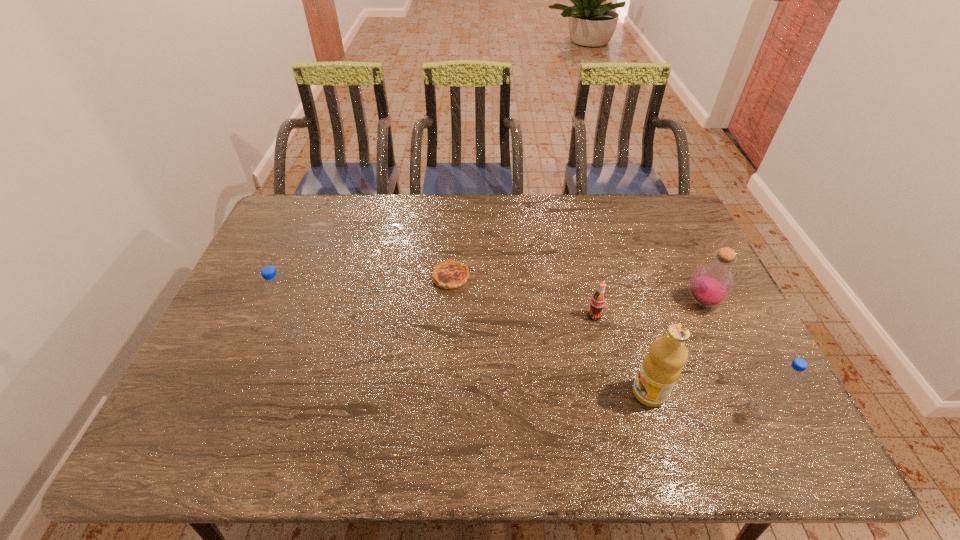
To ensure equal spacing by inserting another water_bottle among them, please point out a vacant spot for this new water_bottle. Please provide its 2D coordinates. Your answer should be formatted as a tuple, i.e. [(x, y)], where the tuple contains the x and y coordinates of a point satisfying the conditions above.

[(513, 371)]